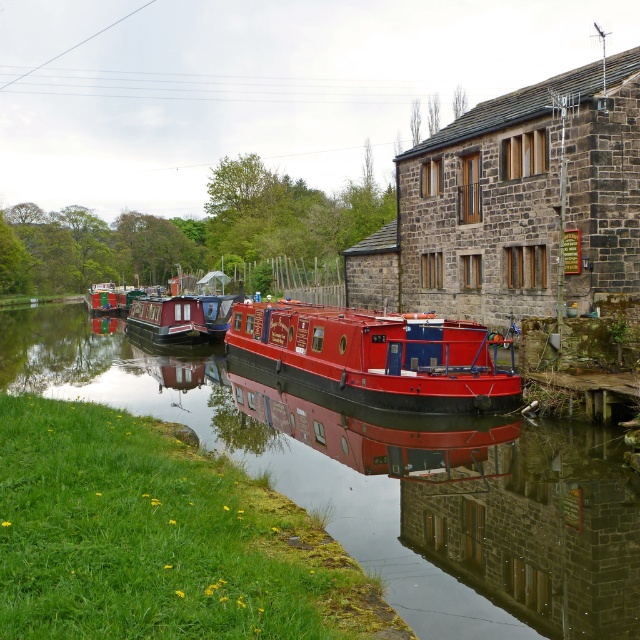
Is smooth red canal boat at center to the left of red polished wooden boat at center from the viewer's perspective?

Incorrect, smooth red canal boat at center is not on the left side of red polished wooden boat at center.

Is smooth red canal boat at center wider than red polished wooden boat at center?

Yes.

Does point (326, 406) come farther from viewer compared to point (148, 301)?

No, it is in front of (148, 301).

Find the location of a particular element. Image resolution: width=640 pixels, height=640 pixels. smooth red canal boat at center is located at coordinates [388, 481].

Does shiny red barge at center come behind red polished wooden boat at center?

That is False.

Which is in front, point (244, 355) or point (198, 324)?

Point (244, 355) is more forward.

This screenshot has width=640, height=640. I want to click on shiny red barge at center, so click(x=376, y=355).

This screenshot has width=640, height=640. In order to click on shiny red barge at center in this screenshot , I will do `click(376, 355)`.

Which is behind, point (435, 320) or point (106, 284)?

Positioned behind is point (106, 284).

Does shiny red barge at center have a larger size compared to metallic red canal boat at left?

No.

Locate an element on the screen. shiny red barge at center is located at coordinates (376, 355).

This screenshot has width=640, height=640. In order to click on shiny red barge at center in this screenshot , I will do `click(376, 355)`.